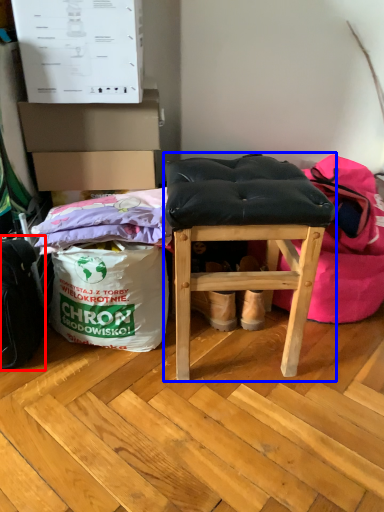
Question: Which of the following is the closest to the observer, messenger bag (highlighted by a red box) or furniture (highlighted by a blue box)?

Choices:
 (A) messenger bag
 (B) furniture

Answer: (B)